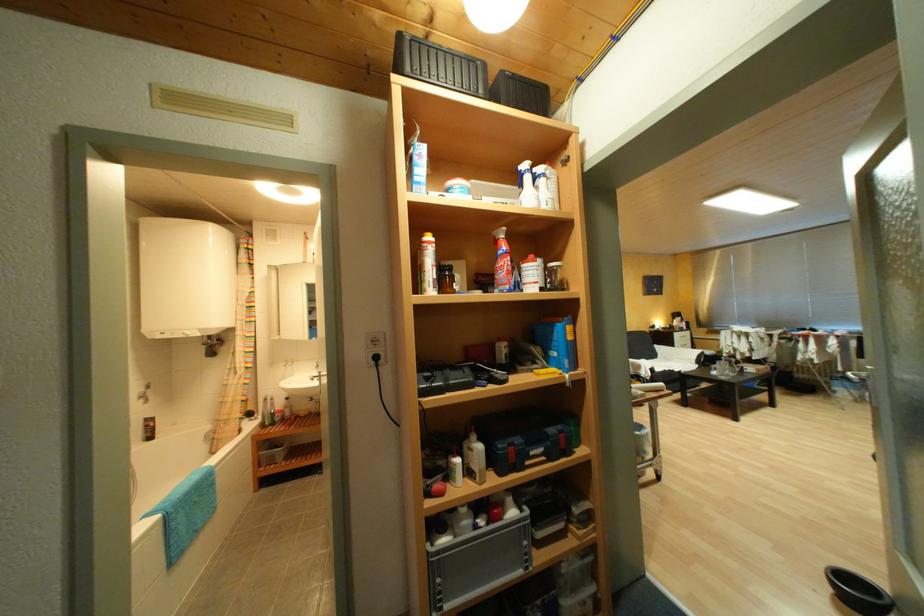
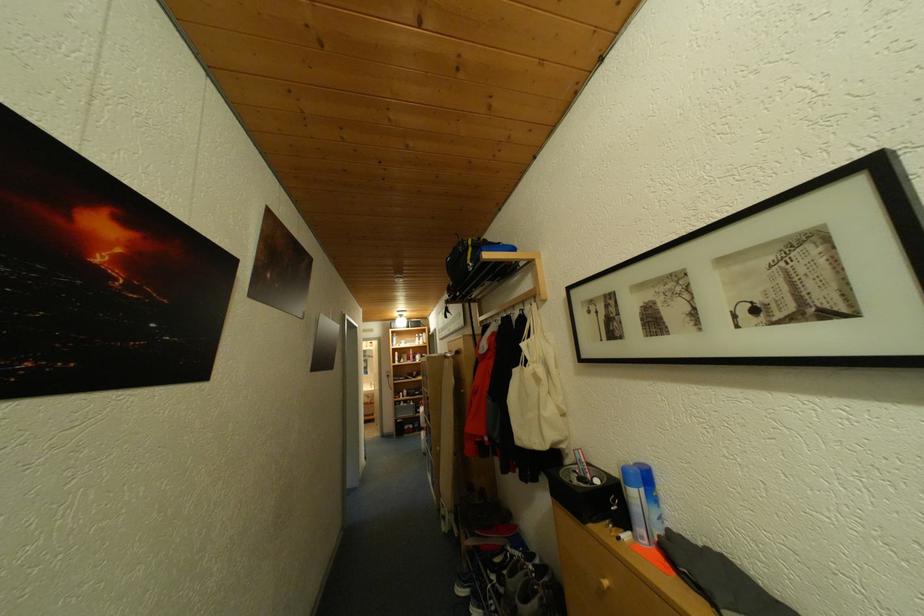
Question: I am providing you with two images of the same scene from different viewpoints. After the viewpoint changes to image2, which objects are now occluded?

Choices:
 (A) small silver pot
 (B) black tray
 (C) black backpack
 (D) green toolbox handle

Answer: (D)